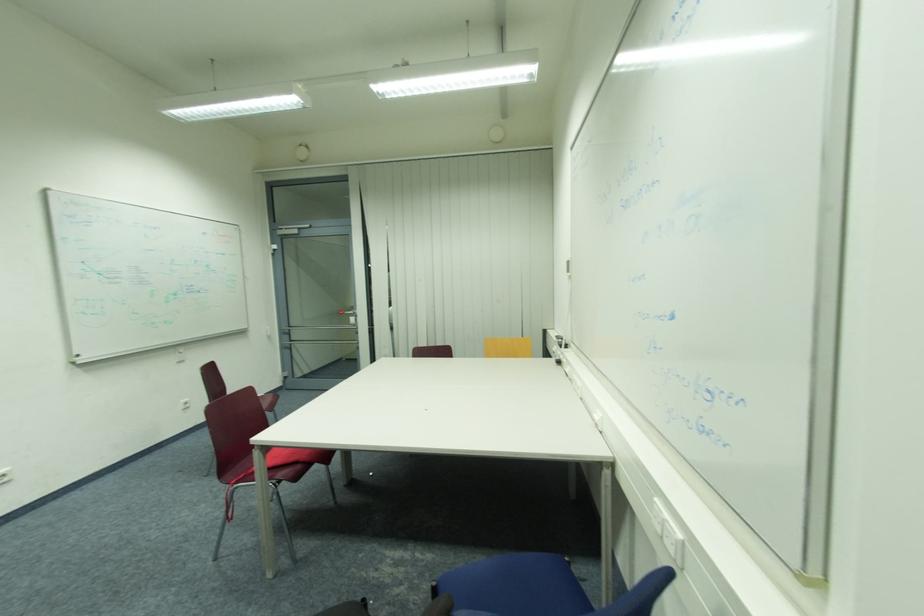
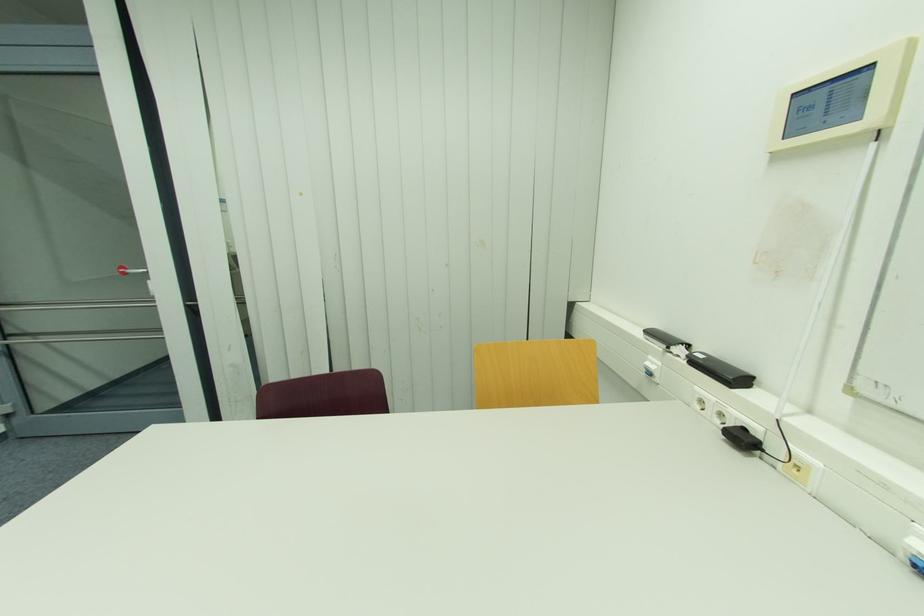
Question: What movement of the cameraman would produce the second image?

Choices:
 (A) Left
 (B) Right
 (C) Forward
 (D) Backward

Answer: (C)